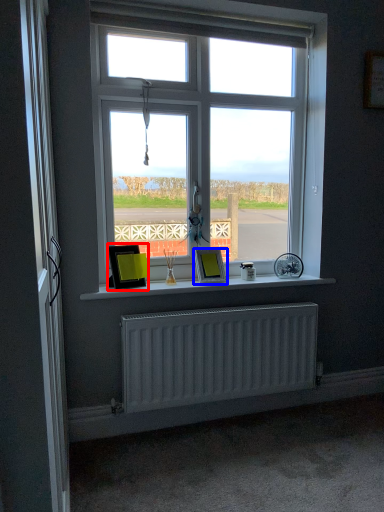
Question: Which of the following is the farthest to the observer, picture frame (highlighted by a red box) or picture frame (highlighted by a blue box)?

Choices:
 (A) picture frame
 (B) picture frame

Answer: (B)